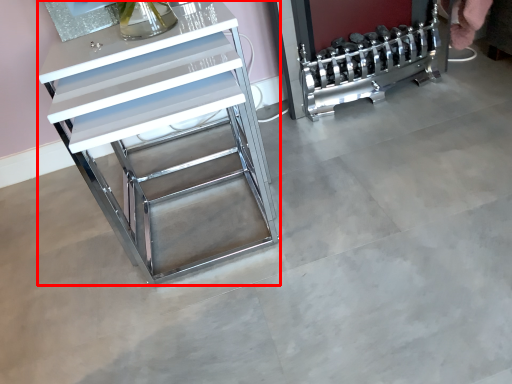
Question: From the image's perspective, what is the correct spatial positioning of furniture (annotated by the red box) in reference to appliance?

Choices:
 (A) above
 (B) below

Answer: (B)